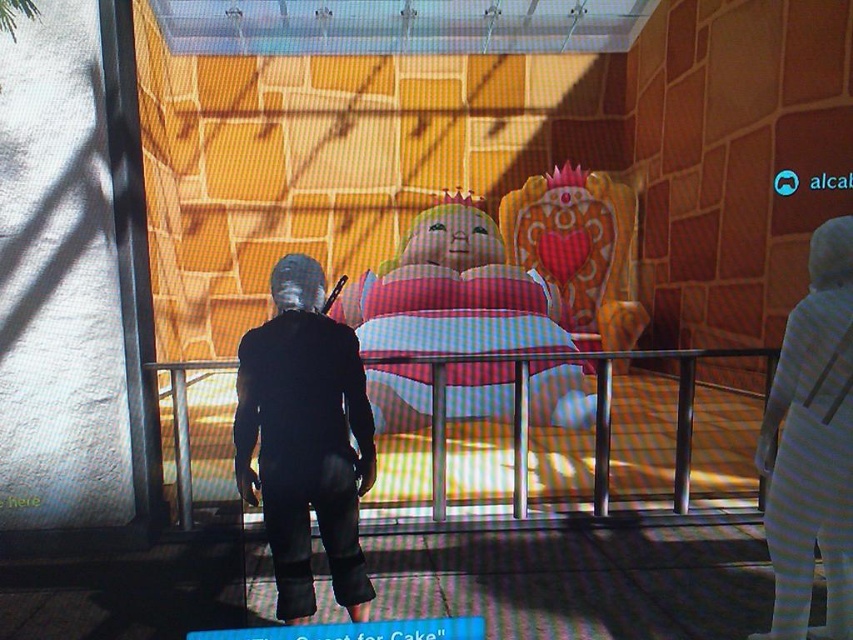
Question: Is plush pink doll at center below black matte suit at center?

Choices:
 (A) yes
 (B) no

Answer: (B)

Question: Which point appears closest to the camera in this image?

Choices:
 (A) (352, 465)
 (B) (811, 419)
 (C) (399, 348)

Answer: (B)

Question: Which point is farther to the camera?

Choices:
 (A) (849, 548)
 (B) (386, 412)

Answer: (B)

Question: Which is farther from the plush pink doll at center?

Choices:
 (A) white striped fabric doll at right
 (B) black matte suit at center

Answer: (A)

Question: In this image, where is black matte suit at center located relative to white striped fabric doll at right?

Choices:
 (A) right
 (B) left

Answer: (B)

Question: Does plush pink doll at center lie behind black matte suit at center?

Choices:
 (A) yes
 (B) no

Answer: (A)